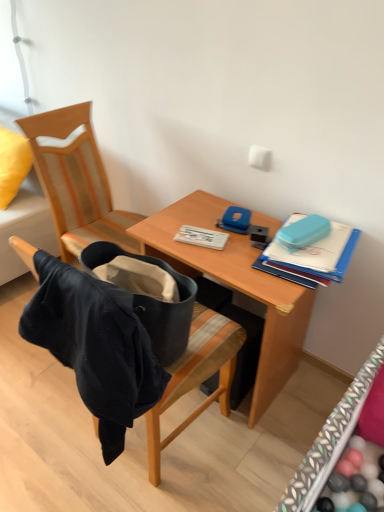
Question: Is wooden desk at center oriented away from velvet yellow pillow at upper left?

Choices:
 (A) yes
 (B) no

Answer: (B)

Question: Is wooden desk at center completely or partially outside of velvet yellow pillow at upper left?

Choices:
 (A) no
 (B) yes

Answer: (B)

Question: Is wooden desk at center far away from velvet yellow pillow at upper left?

Choices:
 (A) yes
 (B) no

Answer: (A)

Question: Is wooden desk at center surrounding velvet yellow pillow at upper left?

Choices:
 (A) no
 (B) yes

Answer: (A)

Question: Can you confirm if wooden desk at center is taller than velvet yellow pillow at upper left?

Choices:
 (A) no
 (B) yes

Answer: (B)

Question: Considering the relative sizes of wooden desk at center and velvet yellow pillow at upper left in the image provided, is wooden desk at center smaller than velvet yellow pillow at upper left?

Choices:
 (A) no
 (B) yes

Answer: (A)

Question: Is teal plastic case at upper right positioned in front of velvet black jacket at left, placed as the 2th chair when sorted from front to back?

Choices:
 (A) no
 (B) yes

Answer: (B)

Question: Is teal plastic case at upper right oriented away from velvet black jacket at left, placed as the 1th chair when sorted from back to front?

Choices:
 (A) yes
 (B) no

Answer: (B)

Question: Is teal plastic case at upper right taller than velvet black jacket at left, placed as the 1th chair when sorted from back to front?

Choices:
 (A) no
 (B) yes

Answer: (A)

Question: From the image's perspective, is teal plastic case at upper right below velvet black jacket at left, placed as the 1th chair when sorted from back to front?

Choices:
 (A) yes
 (B) no

Answer: (A)

Question: From the image's perspective, does teal plastic case at upper right appear higher than velvet black jacket at left, placed as the 2th chair when sorted from front to back?

Choices:
 (A) no
 (B) yes

Answer: (A)

Question: Is teal plastic case at upper right in contact with velvet black jacket at left, placed as the 2th chair when sorted from front to back?

Choices:
 (A) no
 (B) yes

Answer: (A)

Question: Could you tell me if white plastic notebook at center is turned towards velvet yellow pillow at upper left?

Choices:
 (A) no
 (B) yes

Answer: (A)